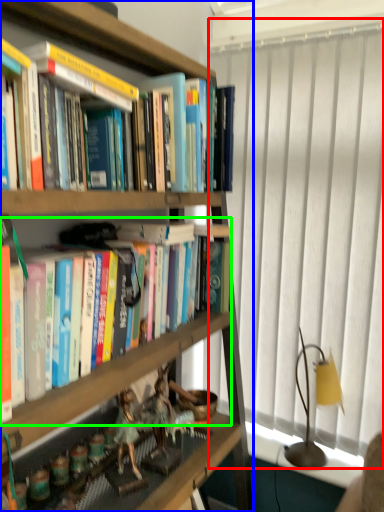
Question: Considering the real-world distances, which object is closest to window screen (highlighted by a red box)? bookcase (highlighted by a blue box) or book (highlighted by a green box).

Choices:
 (A) bookcase
 (B) book

Answer: (B)